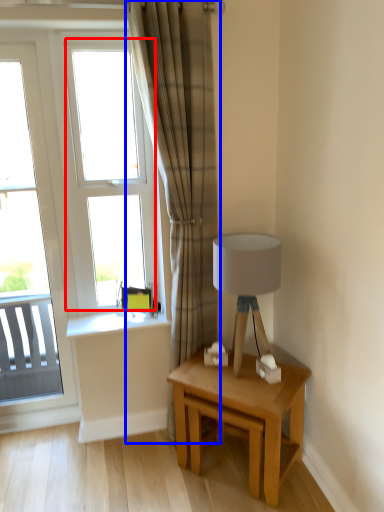
Question: Which point is further to the camera, window (highlighted by a red box) or curtain (highlighted by a blue box)?

Choices:
 (A) window
 (B) curtain

Answer: (A)